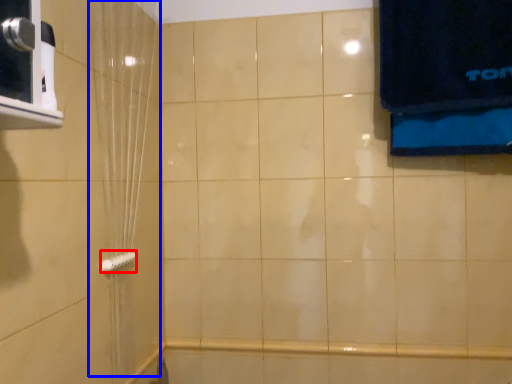
Question: Which object appears closest to the camera in this image, towel bar (highlighted by a red box) or shower curtain (highlighted by a blue box)?

Choices:
 (A) towel bar
 (B) shower curtain

Answer: (B)